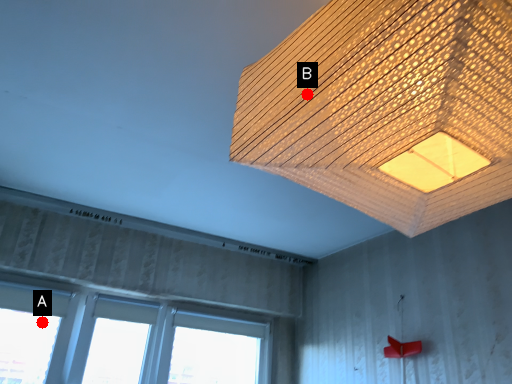
Question: Two points are circled on the image, labeled by A and B beside each circle. Which of the following is the farthest from the observer?

Choices:
 (A) A is further
 (B) B is further

Answer: (A)